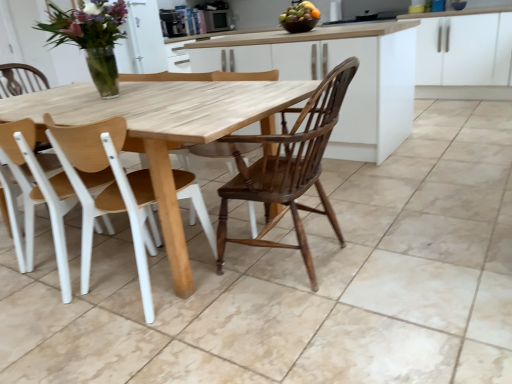
Question: Choose the correct answer: Is wooden at center, the 1th chair when ordered from right to left, inside white matte cabinet at upper right or outside it?

Choices:
 (A) inside
 (B) outside

Answer: (B)

Question: Visually, is wooden at center, the 1th chair when ordered from right to left, positioned to the left or to the right of white matte cabinet at upper right?

Choices:
 (A) right
 (B) left

Answer: (B)

Question: Considering the real-world distances, which object is closest to the matte black microwave at upper center?

Choices:
 (A) natural wood table at center
 (B) clear glass vase at upper left
 (C) glossy ceramic bowl at upper center
 (D) wooden at center, the 2th chair viewed from the left
 (E) white plastic chair at left, which is the first chair in left-to-right order

Answer: (C)

Question: Which of these objects is positioned farthest from the wooden at center, the 1th chair when ordered from right to left?

Choices:
 (A) matte black microwave at upper center
 (B) glossy ceramic bowl at upper center
 (C) natural wood table at center
 (D) clear glass vase at upper left
 (E) white plastic chair at left, which is the first chair in left-to-right order

Answer: (A)